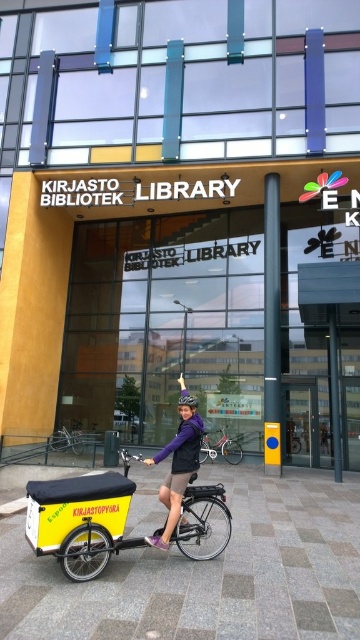
This screenshot has width=360, height=640. What do you see at coordinates (221, 449) in the screenshot? I see `metallic silver bicycle at center` at bounding box center [221, 449].

Does metallic silver bicycle at center have a larger size compared to silver metallic bicycle at lower left?

Yes.

Identify the location of metallic silver bicycle at center. The image size is (360, 640). (221, 449).

Locate an element on the screen. metallic silver bicycle at center is located at coordinates (221, 449).

Can you confirm if purple fabric jacket at center is wider than metallic silver bicycle at center?

No, purple fabric jacket at center is not wider than metallic silver bicycle at center.

Describe the element at coordinates (177, 464) in the screenshot. I see `purple fabric jacket at center` at that location.

What are the coordinates of `purple fabric jacket at center` in the screenshot? It's located at (177, 464).

In the scene shown: Can you confirm if yellow matte cargo bike at lower left is thinner than silver metallic bicycle at lower left?

No, yellow matte cargo bike at lower left is not thinner than silver metallic bicycle at lower left.

Is yellow matte cargo bike at lower left positioned behind silver metallic bicycle at lower left?

No, it is in front of silver metallic bicycle at lower left.

Who is more distant from viewer, (52, 524) or (78, 435)?

The point (78, 435) is behind.

Find the location of a particular element. The height and width of the screenshot is (640, 360). yellow matte cargo bike at lower left is located at coordinates coord(82,518).